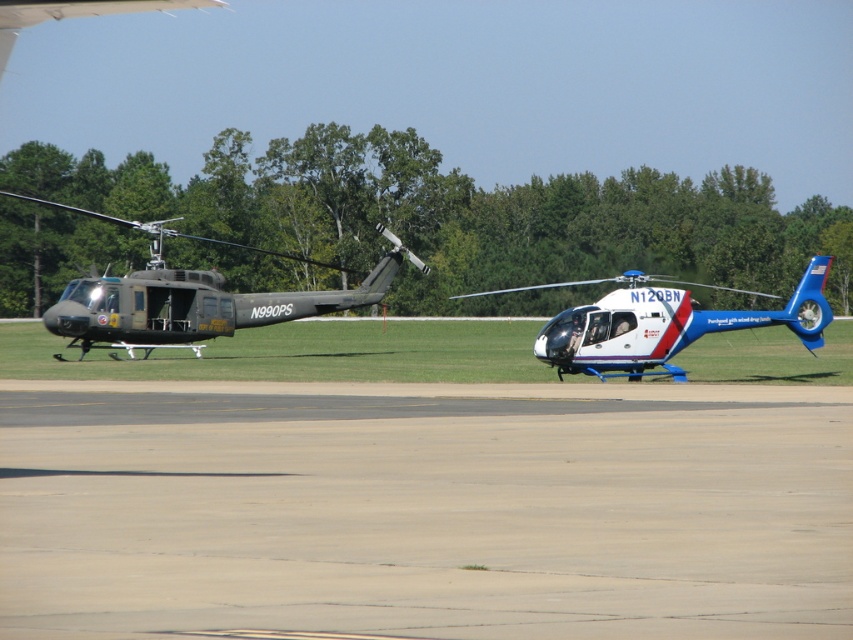
Question: Which of the following is the farthest from the observer?

Choices:
 (A) white glossy helicopter at center
 (B) smooth concrete runway at center

Answer: (A)

Question: Among these objects, which one is farthest from the camera?

Choices:
 (A) smooth concrete runway at center
 (B) matte black helicopter at left

Answer: (B)

Question: Is smooth concrete runway at center wider than matte black helicopter at left?

Choices:
 (A) yes
 (B) no

Answer: (B)

Question: Which point is closer to the camera taking this photo?

Choices:
 (A) (648, 324)
 (B) (476, 435)
 (C) (192, 292)

Answer: (B)

Question: Can you confirm if smooth concrete runway at center is smaller than matte black helicopter at left?

Choices:
 (A) yes
 (B) no

Answer: (A)

Question: Does smooth concrete runway at center appear on the right side of white glossy helicopter at center?

Choices:
 (A) yes
 (B) no

Answer: (B)